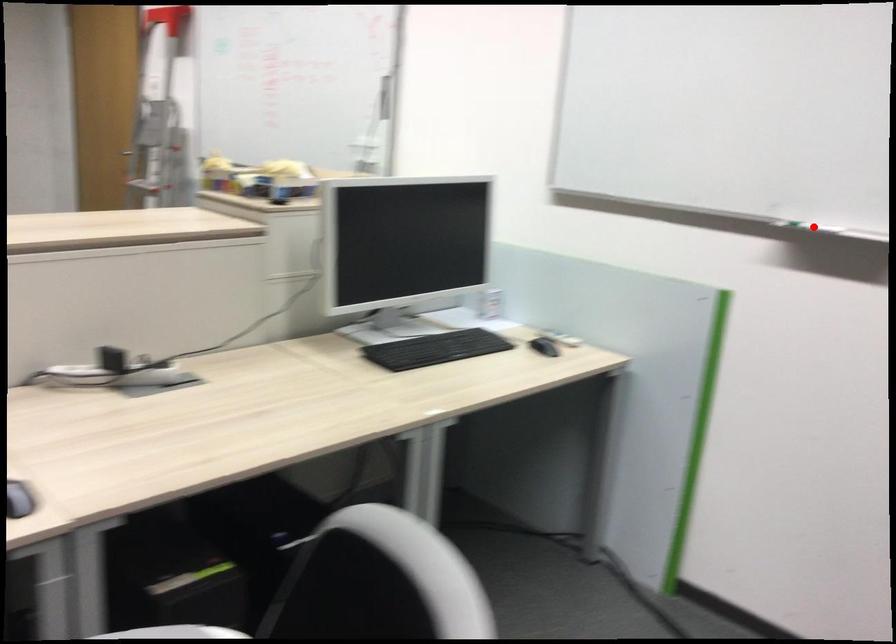
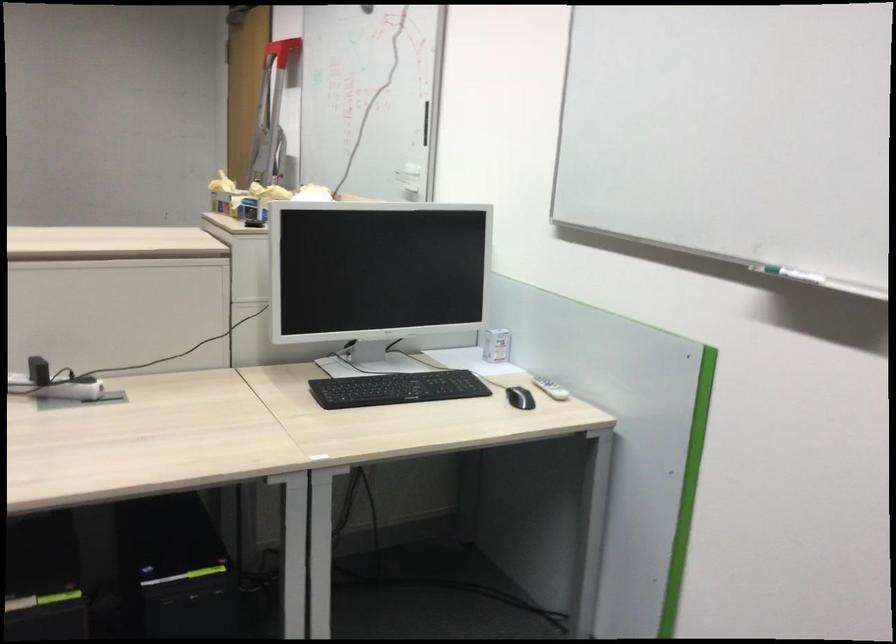
Locate, in the second image, the point that corresponds to the highlighted location in the first image.

(794, 275)